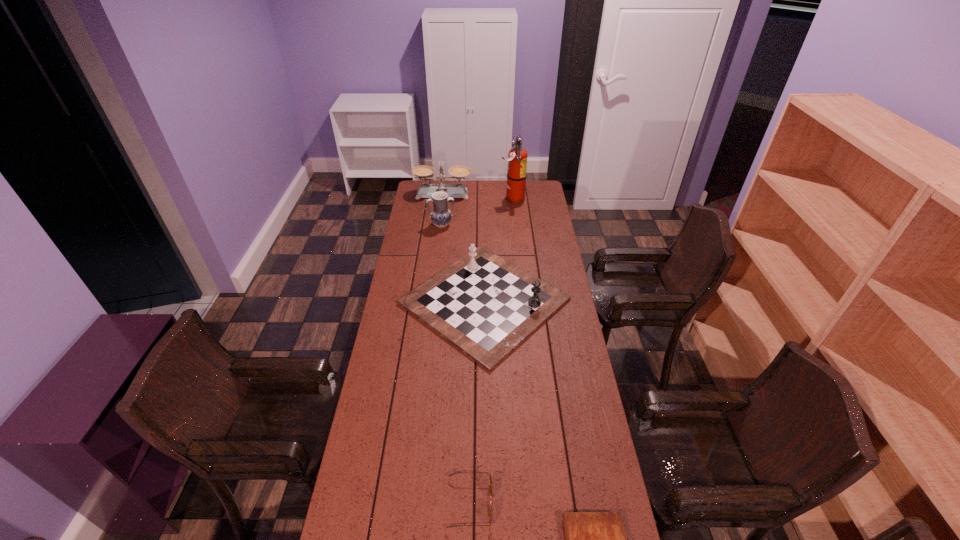
Where is `free area in between the fourth farthest object and the second shortest object`? This screenshot has height=540, width=960. free area in between the fourth farthest object and the second shortest object is located at coordinates (477, 402).

Locate which object is the fourth closest to the fourth farthest object. Please provide its 2D coordinates. Your answer should be formatted as a tuple, i.e. [(x, y)], where the tuple contains the x and y coordinates of a point satisfying the conditions above.

[(424, 172)]

Select which object is the second closest to the third farthest object. Please provide its 2D coordinates. Your answer should be formatted as a tuple, i.e. [(x, y)], where the tuple contains the x and y coordinates of a point satisfying the conditions above.

[(424, 172)]

The height and width of the screenshot is (540, 960). Identify the location of free location that satisfies the following two spatial constraints: 1. from the nozzle of the fire extinguisher; 2. on the front side of the fourth nearest object. (516, 225).

Identify the location of free location that satisfies the following two spatial constraints: 1. on the front-facing side of the third farthest object; 2. on the left side of the scale. (439, 225).

What are the coordinates of `free space in the image that satisfies the following two spatial constraints: 1. from the nozzle of the fire extinguisher; 2. on the front side of the pottery` in the screenshot? It's located at 516,225.